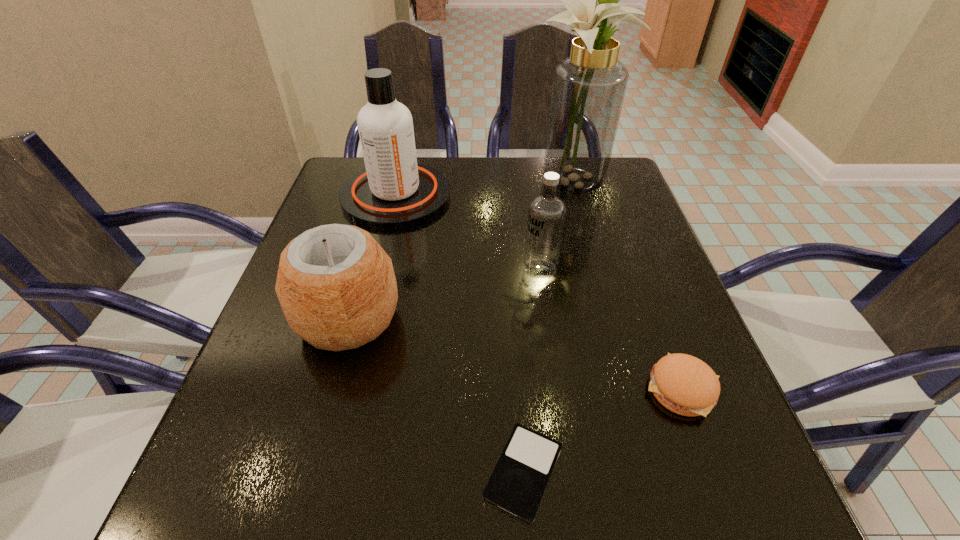
Locate an element on the screen. This screenshot has width=960, height=540. free region located 0.220m on the front label of the fourth nearest object is located at coordinates (420, 269).

Locate an element on the screen. free location located on the front label of the fourth nearest object is located at coordinates (468, 269).

Locate an element on the screen. Image resolution: width=960 pixels, height=540 pixels. blank space located 0.120m on the front label of the fourth nearest object is located at coordinates (468, 269).

Where is `free spot located 0.230m on the back of the patty`? This screenshot has width=960, height=540. free spot located 0.230m on the back of the patty is located at coordinates (636, 269).

I want to click on vacant region located on the left of the shortest object, so click(x=241, y=472).

Identify the location of flower arrangement at the far edge. Image resolution: width=960 pixels, height=540 pixels. (588, 89).

Image resolution: width=960 pixels, height=540 pixels. Identify the location of cleansing agent located in the far edge section of the desktop. 394,191.

Locate an element on the screen. The height and width of the screenshot is (540, 960). object located at the near edge is located at coordinates (517, 484).

You are a GUI agent. You are given a task and a screenshot of the screen. Output one action in this format:
    pyautogui.click(x=<x>, y=<y>)
    Task: Click on the cleansing agent that is positioned at the left edge
    This screenshot has height=540, width=960.
    Given the screenshot: What is the action you would take?
    pyautogui.click(x=394, y=191)

At what (x,y) coordinates should I click in order to perform the action: click on coconut that is at the left edge. Please return your answer as a coordinate pair (x, y). This screenshot has height=540, width=960. Looking at the image, I should click on (x=336, y=285).